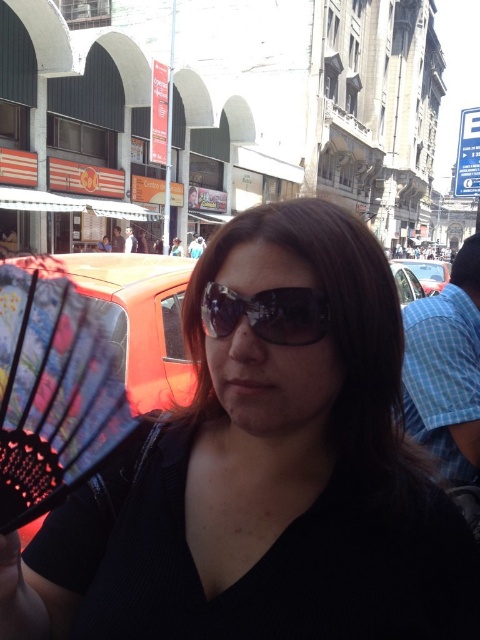
Is black fabric fan at center wider than black reflective sunglasses at center?

Yes.

Which is above, black fabric fan at center or black reflective sunglasses at center?

black reflective sunglasses at center

Is point (190, 520) in front of point (229, 307)?

No, it is behind (229, 307).

Find the location of a particular element. The width and height of the screenshot is (480, 640). black fabric fan at center is located at coordinates pos(264,477).

Can you confirm if black fabric fan at center is shorter than metallic silver car at right?

Indeed, black fabric fan at center has a lesser height compared to metallic silver car at right.

Does black fabric fan at center have a greater width compared to metallic silver car at right?

No, black fabric fan at center is not wider than metallic silver car at right.

Who is more forward, [336,209] or [434,285]?

Point [336,209] is in front.

This screenshot has height=640, width=480. In order to click on black fabric fan at center in this screenshot , I will do `click(264, 477)`.

Can you confirm if black reflective sunglasses at center is wider than metallic silver car at right?

No, black reflective sunglasses at center is not wider than metallic silver car at right.

Is black reflective sunglasses at center below metallic silver car at right?

Yes.

What do you see at coordinates (266, 314) in the screenshot?
I see `black reflective sunglasses at center` at bounding box center [266, 314].

You are a GUI agent. You are given a task and a screenshot of the screen. Output one action in this format:
    pyautogui.click(x=<x>, y=<y>)
    Task: Click on the black reflective sunglasses at center
    
    Given the screenshot: What is the action you would take?
    pyautogui.click(x=266, y=314)